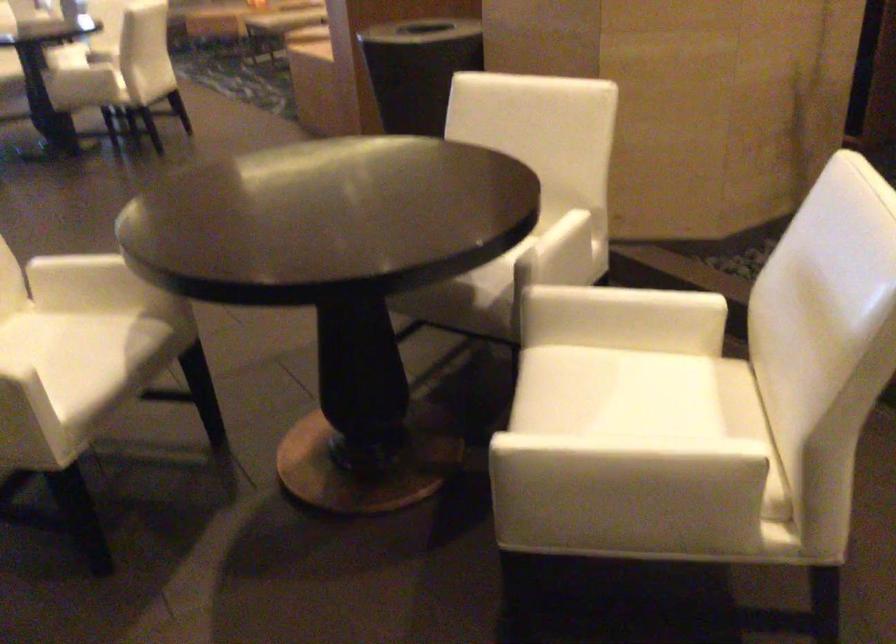
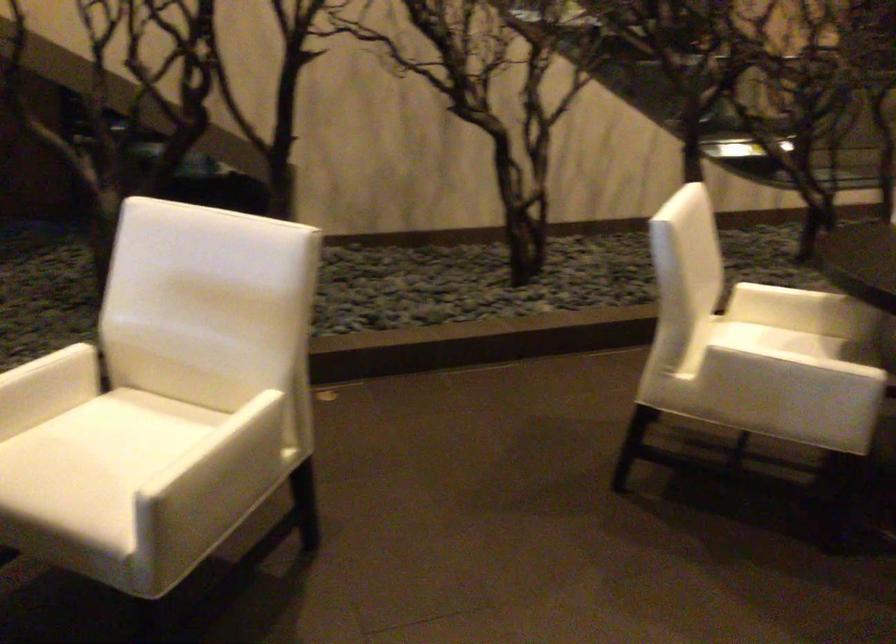
Where in the second image is the point corresponding to [670,301] from the first image?

(58, 362)